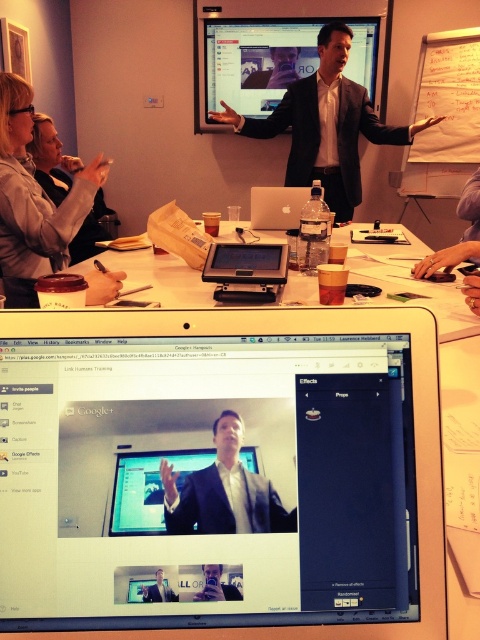
Question: Which of these objects is positioned farthest from the matte black suit at center?

Choices:
 (A) silver/black laptop at center
 (B) black suit at center
 (C) matte black monitor at center
 (D) light gray shirt at upper left

Answer: (B)

Question: Is matte black monitor at center closer to camera compared to matte gray sweater at upper left?

Choices:
 (A) no
 (B) yes

Answer: (B)

Question: Estimate the real-world distances between objects in this image. Which object is closer to the matte black suit at upper center?

Choices:
 (A) matte black monitor at center
 (B) matte black monitor at upper center
 (C) silver/black laptop at center

Answer: (B)

Question: Can you confirm if matte black suit at center is thinner than matte gray sweater at upper left?

Choices:
 (A) no
 (B) yes

Answer: (B)

Question: Which object is the farthest from the matte gray sweater at upper left?

Choices:
 (A) silver/black laptop at center
 (B) light gray shirt at upper left
 (C) silver metallic laptop at center

Answer: (C)

Question: Can you confirm if matte black suit at center is positioned to the right of matte gray sweater at upper left?

Choices:
 (A) yes
 (B) no

Answer: (A)